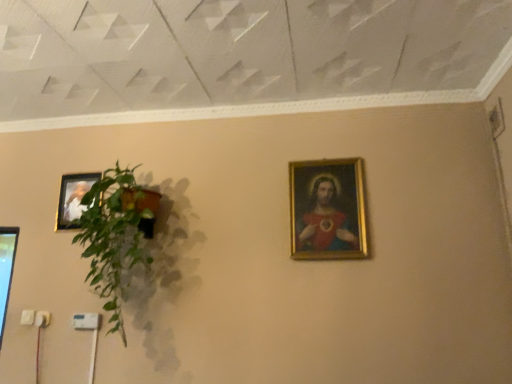
Question: From the image's perspective, is green leafy plant at left above or below matte gold picture frame at upper left, marked as the 2th picture frame in a front-to-back arrangement?

Choices:
 (A) above
 (B) below

Answer: (B)

Question: In terms of width, does green leafy plant at left look wider or thinner when compared to matte gold picture frame at upper left, placed as the 2th picture frame when sorted from right to left?

Choices:
 (A) thin
 (B) wide

Answer: (B)

Question: Estimate the real-world distances between objects in this image. Which object is farther from the gold-framed painting at upper right, which is the 1th picture frame from right to left?

Choices:
 (A) green leafy plant at left
 (B) matte gold picture frame at upper left, arranged as the first picture frame when viewed from the back

Answer: (B)

Question: Which of these objects is positioned farthest from the gold-framed painting at upper right, which ranks as the second picture frame in left-to-right order?

Choices:
 (A) green leafy plant at left
 (B) matte gold picture frame at upper left, placed as the 2th picture frame when sorted from right to left

Answer: (B)